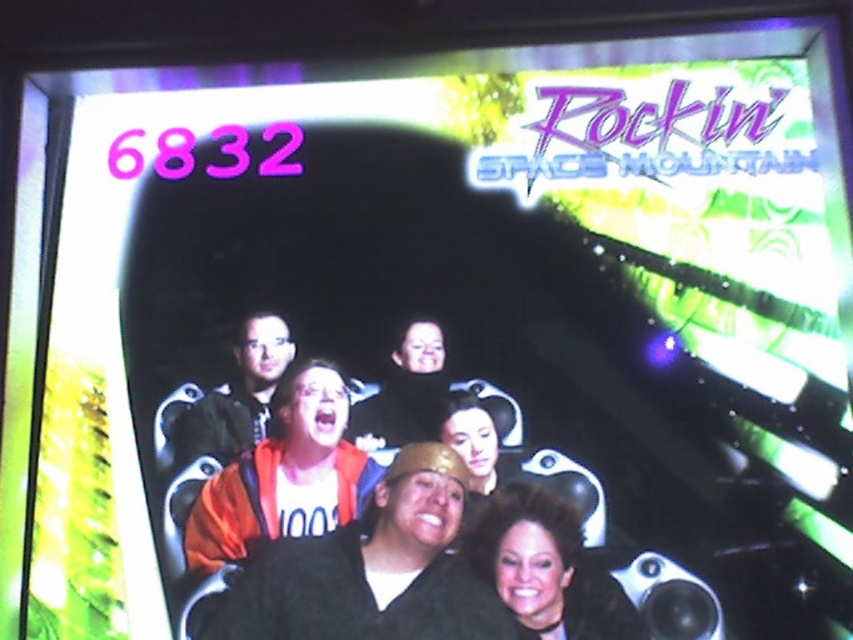
Between black matte jacket at center and shiny black hair at center, which one has less height?

shiny black hair at center

Between black matte jacket at center and shiny black hair at center, which one has more height?

black matte jacket at center

At what (x,y) coordinates should I click in order to perform the action: click on black matte jacket at center. Please return your answer as a coordinate pair (x, y). The width and height of the screenshot is (853, 640). Looking at the image, I should click on (372, 570).